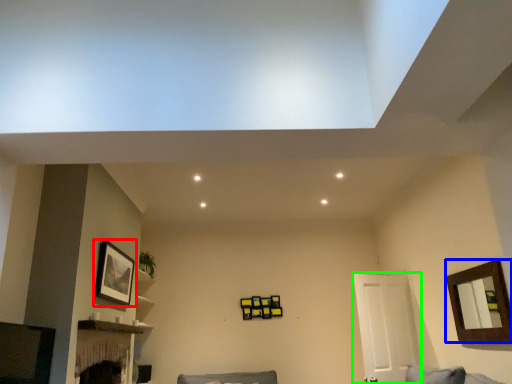
Question: Based on their relative distances, which object is nearer to picture frame (highlighted by a red box)? Choose from picture frame (highlighted by a blue box) and door (highlighted by a green box).

Choices:
 (A) picture frame
 (B) door

Answer: (B)